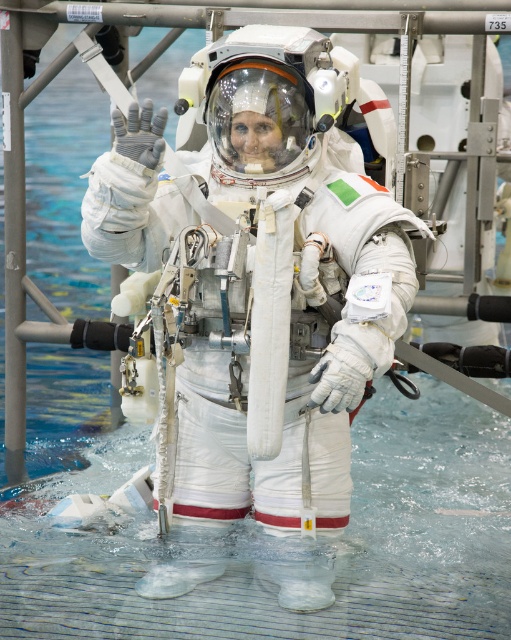
Who is taller, white matte spacesuit at center or clear plastic water at center?

white matte spacesuit at center

Is white matte spacesuit at center positioned behind clear plastic water at center?

No, it is in front of clear plastic water at center.

Which is behind, point (150, 131) or point (168, 550)?

The point (168, 550) is behind.

I want to click on white matte spacesuit at center, so click(258, 280).